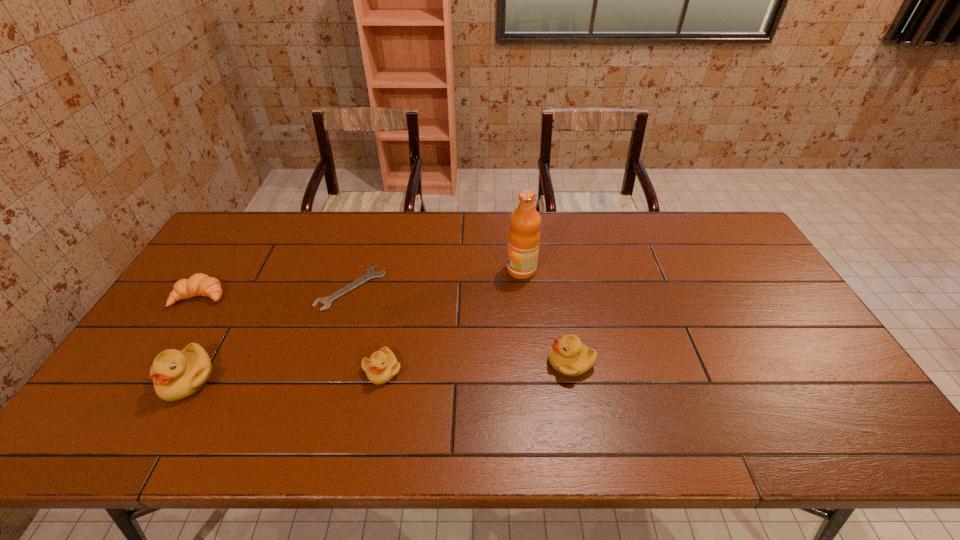
Identify the location of free space located on the front-facing side of the rightmost duckling. Image resolution: width=960 pixels, height=540 pixels. (432, 362).

Find the location of a particular element. vacant space situated 0.150m on the front-facing side of the rightmost duckling is located at coordinates (490, 362).

I want to click on vacant region located 0.380m on the label side of the fruit juice, so click(387, 270).

The height and width of the screenshot is (540, 960). Find the location of `vacant space located 0.200m on the label side of the fruit juice`. vacant space located 0.200m on the label side of the fruit juice is located at coordinates (444, 270).

Find the location of a particular element. The width and height of the screenshot is (960, 540). vacant space located on the label side of the fruit juice is located at coordinates 434,270.

You are a GUI agent. You are given a task and a screenshot of the screen. Output one action in this format:
    pyautogui.click(x=<x>, y=<y>)
    Task: Click on the vacant space situated on the left of the wrench
    
    Given the screenshot: What is the action you would take?
    pyautogui.click(x=252, y=288)

This screenshot has height=540, width=960. I want to click on free space located 0.140m on the front of the second shortest object, so click(166, 350).

This screenshot has height=540, width=960. Identify the location of duckling present at the left edge. (176, 375).

Where is `crescent roll situated at the left edge`? The image size is (960, 540). crescent roll situated at the left edge is located at coordinates (199, 284).

Image resolution: width=960 pixels, height=540 pixels. I want to click on object located in the near left corner section of the desktop, so click(176, 375).